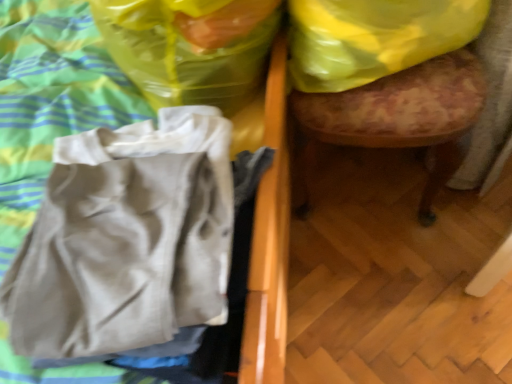
Question: Is wooden upholstered stool at right behind yellow plastic bag at upper right, the 2th plastic bag from the left?

Choices:
 (A) no
 (B) yes

Answer: (A)

Question: Does wooden upholstered stool at right come in front of yellow plastic bag at upper right, the 1th plastic bag viewed from the right?

Choices:
 (A) no
 (B) yes

Answer: (B)

Question: From a real-world perspective, is wooden upholstered stool at right positioned under yellow plastic bag at upper right, the 2th plastic bag from the left, based on gravity?

Choices:
 (A) no
 (B) yes

Answer: (B)

Question: Can you confirm if wooden upholstered stool at right is smaller than yellow plastic bag at upper right, the 2th plastic bag from the left?

Choices:
 (A) yes
 (B) no

Answer: (B)

Question: Does wooden upholstered stool at right appear on the left side of yellow plastic bag at upper right, the 2th plastic bag from the left?

Choices:
 (A) yes
 (B) no

Answer: (B)

Question: Which is correct: yellow plastic bag at upper right, the 1th plastic bag viewed from the right, is inside wooden upholstered stool at right, or outside of it?

Choices:
 (A) outside
 (B) inside

Answer: (B)

Question: Does point (424, 48) appear closer or farther from the camera than point (437, 180)?

Choices:
 (A) farther
 (B) closer

Answer: (B)

Question: In terms of height, does yellow plastic bag at upper right, the 1th plastic bag viewed from the right, look taller or shorter compared to wooden upholstered stool at right?

Choices:
 (A) tall
 (B) short

Answer: (B)

Question: Considering the relative positions of yellow plastic bag at upper right, the 2th plastic bag from the left, and wooden upholstered stool at right in the image provided, is yellow plastic bag at upper right, the 2th plastic bag from the left, to the left or to the right of wooden upholstered stool at right?

Choices:
 (A) left
 (B) right

Answer: (A)

Question: Does point (397, 77) appear closer or farther from the camera than point (473, 29)?

Choices:
 (A) closer
 (B) farther

Answer: (B)

Question: From a real-world perspective, is wooden upholstered stool at right above or below yellow plastic bag at upper right, the 1th plastic bag viewed from the right?

Choices:
 (A) below
 (B) above

Answer: (A)

Question: From the image's perspective, is wooden upholstered stool at right located above or below yellow plastic bag at upper right, the 1th plastic bag viewed from the right?

Choices:
 (A) above
 (B) below

Answer: (B)

Question: Is wooden upholstered stool at right bigger or smaller than yellow plastic bag at upper right, the 2th plastic bag from the left?

Choices:
 (A) big
 (B) small

Answer: (A)

Question: Is translucent yellow plastic bag at upper right, which ranks as the 1th plastic bag in left-to-right order, situated inside yellow plastic bag at upper right, the 2th plastic bag from the left, or outside?

Choices:
 (A) outside
 (B) inside

Answer: (A)

Question: From a real-world perspective, relative to yellow plastic bag at upper right, the 2th plastic bag from the left, is translucent yellow plastic bag at upper right, which ranks as the 2th plastic bag in right-to-left order, vertically above or below?

Choices:
 (A) above
 (B) below

Answer: (A)